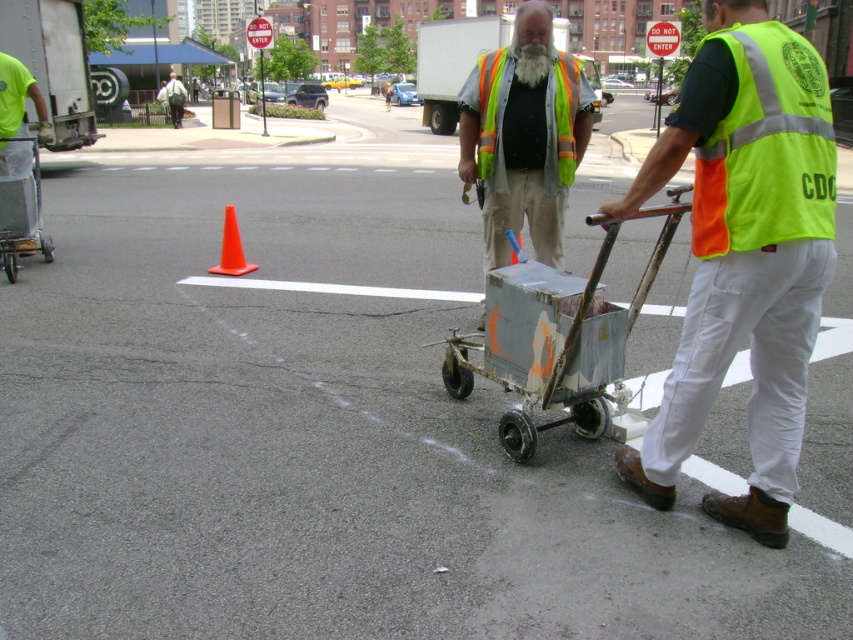
Describe the element at coordinates (766, 147) in the screenshot. The height and width of the screenshot is (640, 853). I see `neon yellow reflective vest at center-right` at that location.

Does point (718, 144) lie in front of point (161, 90)?

Yes, point (718, 144) is closer to viewer.

Between point (799, 44) and point (178, 99), which one is positioned behind?

The point (178, 99) is more distant.

This screenshot has width=853, height=640. In order to click on neon yellow reflective vest at center-right in this screenshot , I will do `click(766, 147)`.

How far apart are neon yellow reflective vest at center and neon yellow reflective vest at center-right?

11.26 inches

Which of these two, neon yellow reflective vest at center or neon yellow reflective vest at center-right, stands shorter?

Standing shorter between the two is neon yellow reflective vest at center-right.

Identify the location of neon yellow reflective vest at center. (744, 253).

Can you confirm if neon yellow reflective vest at center-right is bigger than reflective safety vest at center?

No, neon yellow reflective vest at center-right is not bigger than reflective safety vest at center.

In the scene shown: Between neon yellow reflective vest at center-right and reflective safety vest at center, which one appears on the right side from the viewer's perspective?

Positioned to the right is neon yellow reflective vest at center-right.

You are a GUI agent. You are given a task and a screenshot of the screen. Output one action in this format:
    pyautogui.click(x=<x>, y=<y>)
    Task: Click on the neon yellow reflective vest at center-right
    This screenshot has width=853, height=640.
    Given the screenshot: What is the action you would take?
    (x=766, y=147)